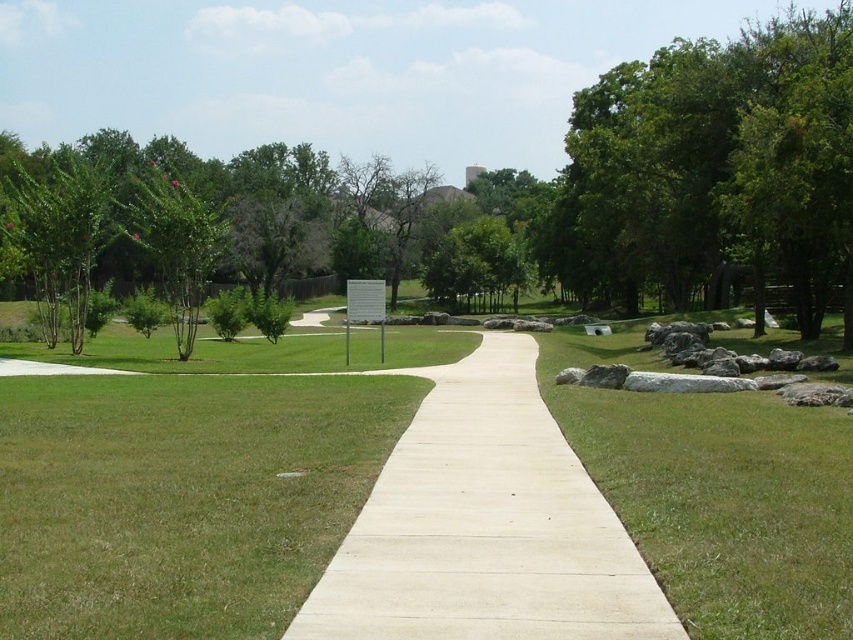
Question: Is green leafy tree at upper right closer to the viewer compared to green leafy tree at left?

Choices:
 (A) no
 (B) yes

Answer: (B)

Question: Which point appears closest to the camera in this image?

Choices:
 (A) (570, 561)
 (B) (109, 612)
 (C) (614, 204)
 (D) (201, 227)

Answer: (B)

Question: Does white concrete path at center lie behind green leafy tree at left?

Choices:
 (A) no
 (B) yes

Answer: (A)

Question: Can you confirm if white concrete path at center is positioned above white concrete pavement at center?

Choices:
 (A) no
 (B) yes

Answer: (B)

Question: Which point is closer to the camera taking this photo?

Choices:
 (A) (747, 509)
 (B) (473, 564)
 (C) (155, 225)
 (D) (811, 276)

Answer: (B)

Question: Which object is farther from the camera taking this photo?

Choices:
 (A) white concrete pavement at center
 (B) green leafy tree at upper right

Answer: (B)